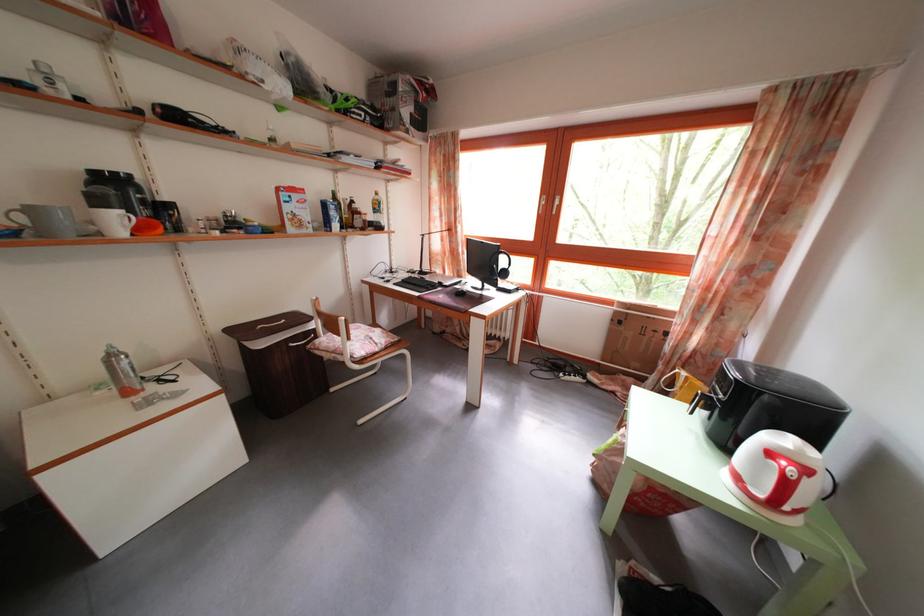
Where would you pull the white window handle? Please return your answer as a coordinate pair (x, y).

(541, 204)